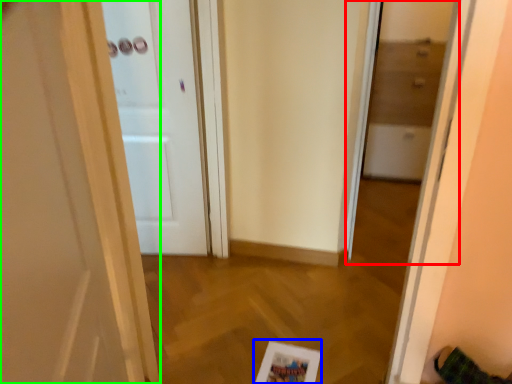
Question: Based on their relative distances, which object is farther from glass door (highlighted by a red box)? Choose from picture frame (highlighted by a blue box) and door (highlighted by a green box).

Choices:
 (A) picture frame
 (B) door

Answer: (B)